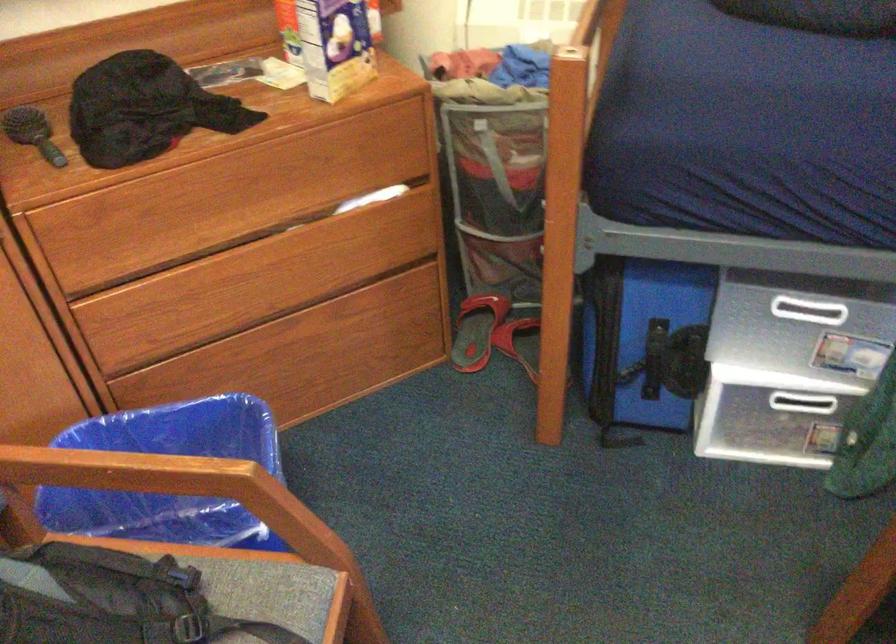
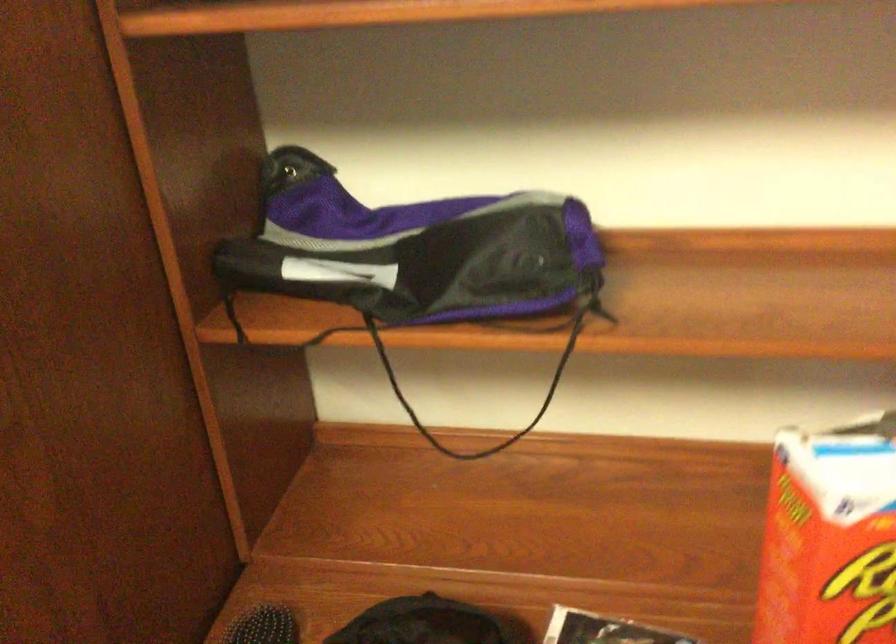
Question: How did the camera likely rotate?

Choices:
 (A) Left
 (B) Right
 (C) Up
 (D) Down

Answer: (A)